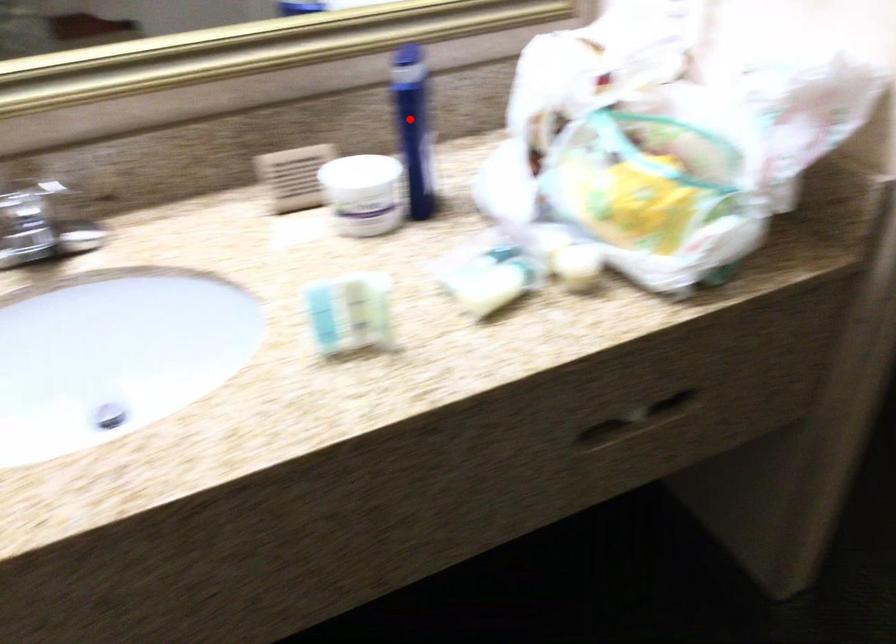
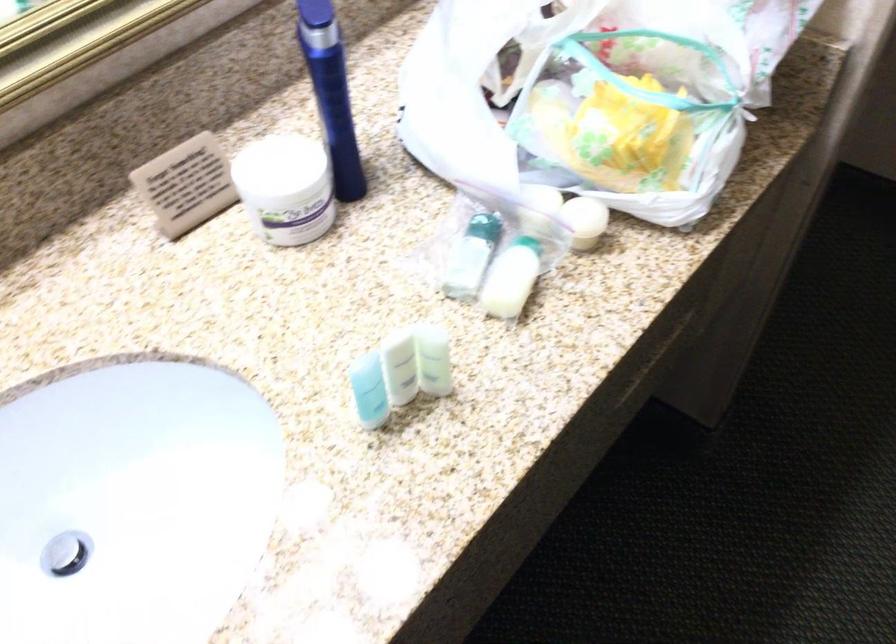
The point at the highlighted location is marked in the first image. Where is the corresponding point in the second image?

(331, 93)